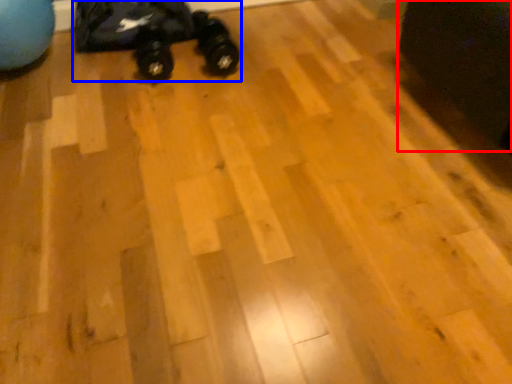
Question: Among these objects, which one is nearest to the camera, swivel chair (highlighted by a red box) or toy car (highlighted by a blue box)?

Choices:
 (A) swivel chair
 (B) toy car

Answer: (A)